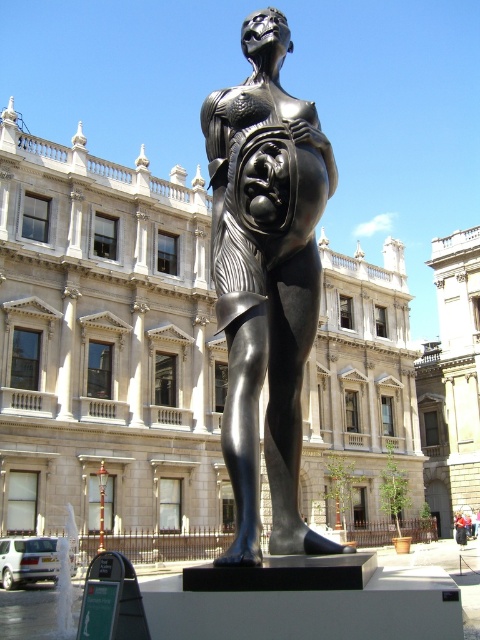
You are a photographer planning to take a full body shot of the polished bronze statue at center and the dark blue jeans at center. Which object should you focus on first if you want to ensure both are in the frame without moving the camera?

You should focus on the polished bronze statue at center first because it might be wider than the dark blue jeans at center, so centering it will help include both in the frame.

You are a photographer standing in the public square. You want to capture a photo of the polished bronze statue at center without the dark blue jeans at center appearing in the foreground. Is this possible based on their positions?

The polished bronze statue at center is located above dark blue jeans at center, so yes, you can position yourself so that the statue is framed above the jeans, preventing them from appearing in the foreground.